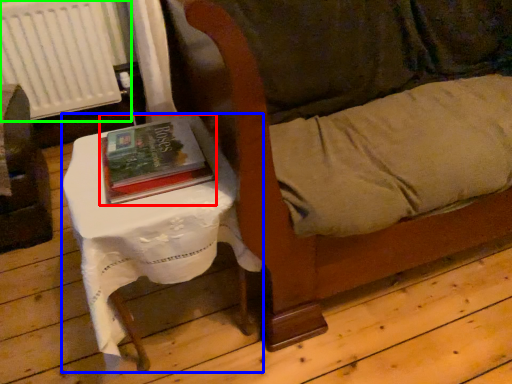
Question: Which object is the farthest from book (highlighted by a red box)? Choose among these: table (highlighted by a blue box) or radiator (highlighted by a green box).

Choices:
 (A) table
 (B) radiator

Answer: (B)